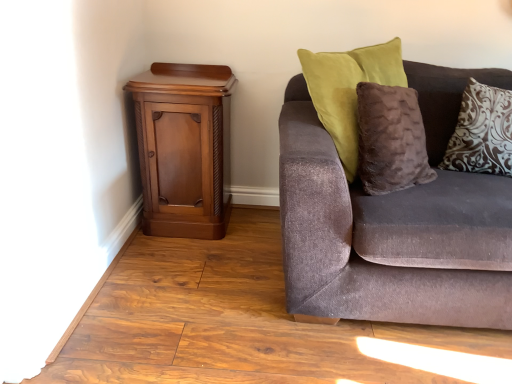
Question: From a real-world perspective, is mahogany wood cabinet at left physically above brown damask pillow at upper right?

Choices:
 (A) yes
 (B) no

Answer: (B)

Question: Is mahogany wood cabinet at left to the right of brown damask pillow at upper right from the viewer's perspective?

Choices:
 (A) yes
 (B) no

Answer: (B)

Question: Is mahogany wood cabinet at left at the left side of brown damask pillow at upper right?

Choices:
 (A) yes
 (B) no

Answer: (A)

Question: Can you confirm if mahogany wood cabinet at left is smaller than brown damask pillow at upper right?

Choices:
 (A) yes
 (B) no

Answer: (B)

Question: Considering the relative sizes of mahogany wood cabinet at left and brown damask pillow at upper right in the image provided, is mahogany wood cabinet at left bigger than brown damask pillow at upper right?

Choices:
 (A) yes
 (B) no

Answer: (A)

Question: Is mahogany wood cabinet at left far away from brown damask pillow at upper right?

Choices:
 (A) no
 (B) yes

Answer: (B)

Question: Does mahogany wood cabinet at left appear on the left side of velvet brown couch at right?

Choices:
 (A) no
 (B) yes

Answer: (B)

Question: Considering the relative positions of mahogany wood cabinet at left and velvet brown couch at right in the image provided, is mahogany wood cabinet at left in front of velvet brown couch at right?

Choices:
 (A) no
 (B) yes

Answer: (A)

Question: Is mahogany wood cabinet at left facing away from velvet brown couch at right?

Choices:
 (A) yes
 (B) no

Answer: (B)

Question: Is mahogany wood cabinet at left facing towards velvet brown couch at right?

Choices:
 (A) no
 (B) yes

Answer: (A)

Question: Is mahogany wood cabinet at left far away from velvet brown couch at right?

Choices:
 (A) yes
 (B) no

Answer: (B)

Question: From the image's perspective, would you say mahogany wood cabinet at left is shown under velvet brown couch at right?

Choices:
 (A) no
 (B) yes

Answer: (A)

Question: Does velvet brown couch at right have a smaller size compared to brown damask pillow at upper right?

Choices:
 (A) no
 (B) yes

Answer: (A)